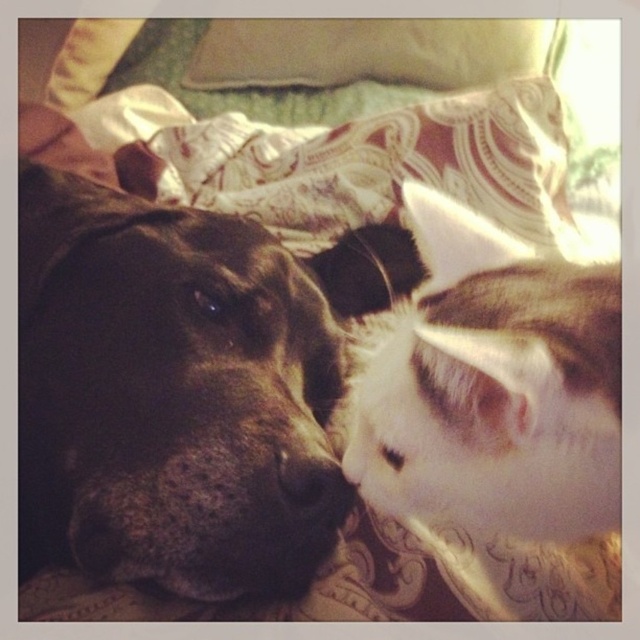
How far apart are white fluffy cat at center and white matte nose at center?

white fluffy cat at center and white matte nose at center are 5.86 inches apart from each other.

Between white fluffy cat at center and white matte nose at center, which one appears on the right side from the viewer's perspective?

From the viewer's perspective, white fluffy cat at center appears more on the right side.

Which is in front, point (449, 321) or point (362, 474)?

Point (449, 321) is more forward.

I want to click on white fluffy cat at center, so click(496, 387).

What do you see at coordinates (180, 387) in the screenshot?
I see `black fur dog at center` at bounding box center [180, 387].

Consider the image. Who is more forward, [134,432] or [433,67]?

Positioned in front is point [134,432].

Locate an element on the screen. black fur dog at center is located at coordinates (x=180, y=387).

Can you confirm if black fur dog at center is taller than white matte nose at center?

Indeed, black fur dog at center has a greater height compared to white matte nose at center.

Who is positioned more to the right, black fur dog at center or white matte nose at center?

white matte nose at center

Is point (314, 422) positioned behind point (342, 472)?

Yes.

You are a GUI agent. You are given a task and a screenshot of the screen. Output one action in this format:
    pyautogui.click(x=<x>, y=<y>)
    Task: Click on the black fur dog at center
    
    Given the screenshot: What is the action you would take?
    pyautogui.click(x=180, y=387)